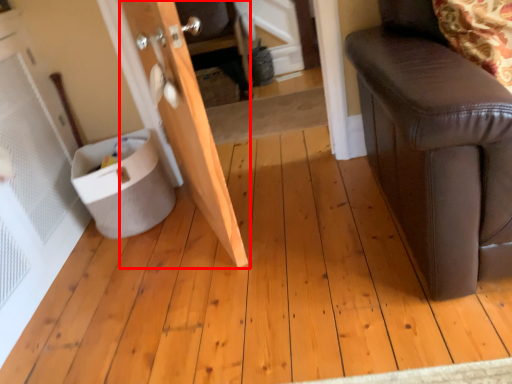
Question: Considering the relative positions of door (annotated by the red box) and potty in the image provided, where is door (annotated by the red box) located with respect to the staircase?

Choices:
 (A) right
 (B) left

Answer: (A)